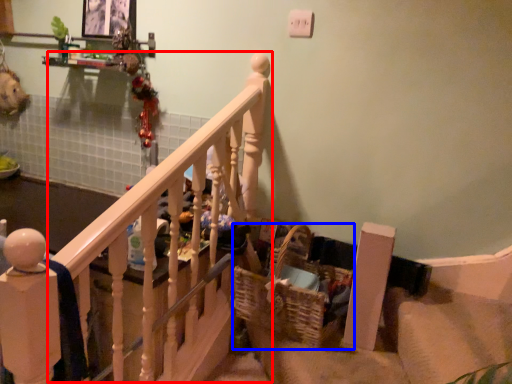
Question: Among these objects, which one is nearest to the camera, rail (highlighted by a red box) or basket (highlighted by a blue box)?

Choices:
 (A) rail
 (B) basket

Answer: (A)